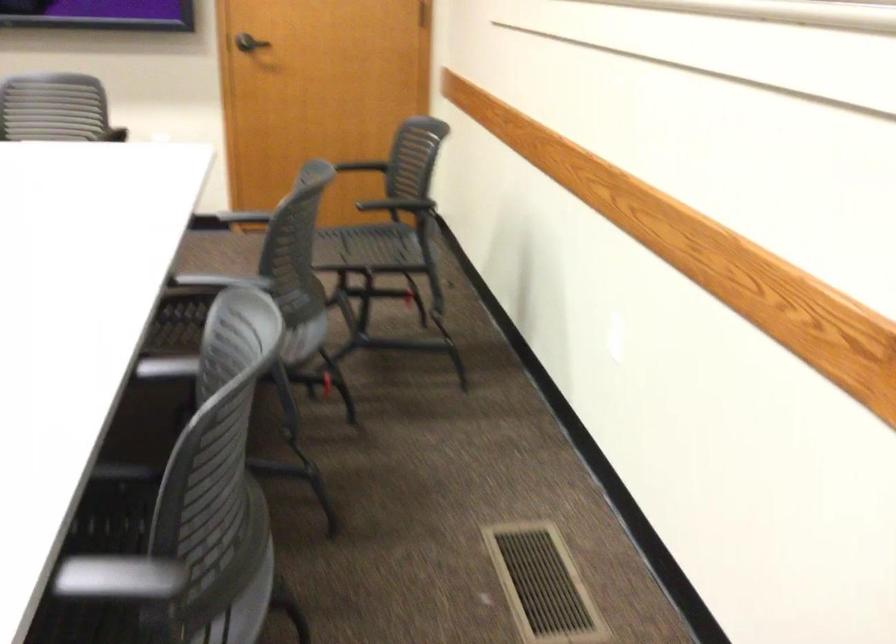
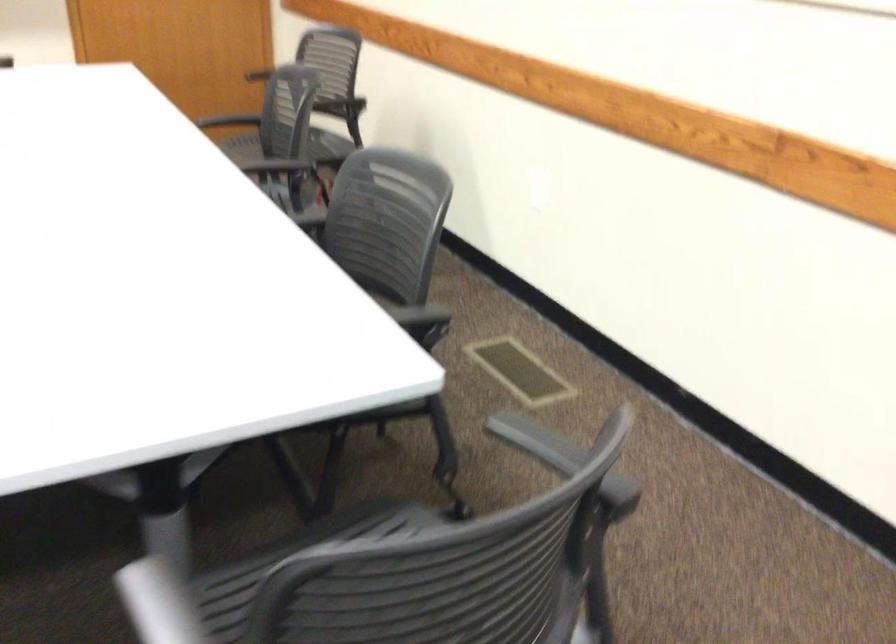
Find the pixel in the second image that matches point 536,574 in the first image.

(520, 370)